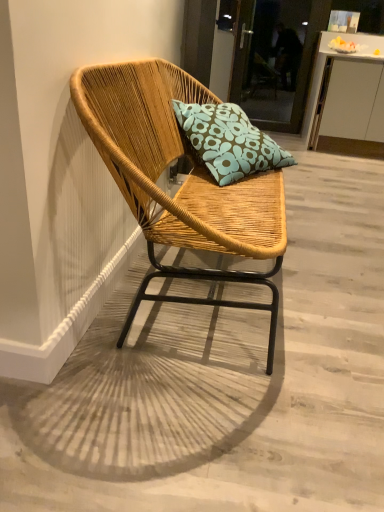
Describe the element at coordinates (225, 382) in the screenshot. I see `natural wood chair at center` at that location.

What is the approximate width of teal floral cushion at center?

20.39 inches.

Identify the location of natural wood chair at center. This screenshot has width=384, height=512. (225, 382).

This screenshot has height=512, width=384. I want to click on glass door behind the white glossy cabinet at upper right, so click(x=304, y=67).

Is transparent glass door at upper center turned away from white glossy cabinet at upper right?

That's not correct — transparent glass door at upper center is not looking away from white glossy cabinet at upper right.

Considering the relative sizes of transparent glass door at upper center and white glossy cabinet at upper right in the image provided, is transparent glass door at upper center shorter than white glossy cabinet at upper right?

Incorrect, the height of transparent glass door at upper center does not fall short of that of white glossy cabinet at upper right.

How different are the orientations of transparent glass door at upper center and white glossy cabinet at upper right in degrees?

The angular difference between transparent glass door at upper center and white glossy cabinet at upper right is 0.00107 degrees.

Is white glossy cabinet at upper right next to transparent glass door at upper center?

No, white glossy cabinet at upper right is not beside transparent glass door at upper center.

Can you confirm if white glossy cabinet at upper right is bigger than transparent glass door at upper center?

Yes, white glossy cabinet at upper right is bigger than transparent glass door at upper center.

Considering the relative sizes of white glossy cabinet at upper right and transparent glass door at upper center in the image provided, is white glossy cabinet at upper right shorter than transparent glass door at upper center?

A: Yes, white glossy cabinet at upper right is shorter than transparent glass door at upper center.

From the image's perspective, is white glossy cabinet at upper right located above transparent glass door at upper center?

Incorrect, from the image's perspective, white glossy cabinet at upper right is lower than transparent glass door at upper center.

Is transparent glass door at upper center spatially inside natural wood chair at center, or outside of it?

transparent glass door at upper center lies outside natural wood chair at center.

Which is behind, point (322, 18) or point (382, 388)?

The point (322, 18) is behind.

Is transparent glass door at upper center bigger or smaller than natural wood chair at center?

In the image, transparent glass door at upper center appears to be smaller than natural wood chair at center.

Who is shorter, transparent glass door at upper center or natural wood chair at center?

natural wood chair at center is shorter.

Looking at this image, how different are the orientations of natural wood chair at center and teal floral cushion at center in degrees?

50 degrees.

In order to click on pillow above the natural wood chair at center (from a real-world perspective) in this screenshot , I will do `click(228, 141)`.

Which is more to the left, natural wood chair at center or teal floral cushion at center?

teal floral cushion at center.

From the image's perspective, is natural wood chair at center above or below teal floral cushion at center?

From the image's perspective, natural wood chair at center appears below teal floral cushion at center.

Which object is closer to the camera taking this photo, natural wood chair at center or transparent glass door at upper center?

natural wood chair at center is more forward.

In terms of height, does natural wood chair at center look taller or shorter compared to transparent glass door at upper center?

natural wood chair at center is shorter than transparent glass door at upper center.

From the image's perspective, is natural wood chair at center located above or below transparent glass door at upper center?

Clearly, from the image's perspective, natural wood chair at center is below transparent glass door at upper center.

Considering the relative sizes of teal floral cushion at center and transparent glass door at upper center in the image provided, is teal floral cushion at center smaller than transparent glass door at upper center?

Correct, teal floral cushion at center occupies less space than transparent glass door at upper center.

This screenshot has height=512, width=384. What are the coordinates of `pillow that appears below the transparent glass door at upper center (from a real-world perspective)` in the screenshot? It's located at (228, 141).

From a real-world perspective, is teal floral cushion at center on top of transparent glass door at upper center?

Actually, teal floral cushion at center is physically below transparent glass door at upper center in the real world.

Is teal floral cushion at center oriented away from transparent glass door at upper center?

No, teal floral cushion at center is not facing away from transparent glass door at upper center.

In the scene shown: How different are the orientations of teal floral cushion at center and natural wood chair at center in degrees?

50 degrees.

I want to click on pillow above the natural wood chair at center (from a real-world perspective), so click(228, 141).

Is natural wood chair at center at the back of teal floral cushion at center?

No, teal floral cushion at center's orientation is not away from natural wood chair at center.

Where is `glass door behind the white glossy cabinet at upper right`? This screenshot has height=512, width=384. glass door behind the white glossy cabinet at upper right is located at coordinates (304, 67).

At what (x,y) coordinates should I click in order to perform the action: click on glass door above the white glossy cabinet at upper right (from a real-world perspective). Please return your answer as a coordinate pair (x, y). Looking at the image, I should click on (304, 67).

Based on their spatial positions, is natural wood chair at center or teal floral cushion at center further from white glossy cabinet at upper right?

The object further to white glossy cabinet at upper right is natural wood chair at center.

Estimate the real-world distances between objects in this image. Which object is further from teal floral cushion at center, transparent glass door at upper center or natural wood chair at center?

transparent glass door at upper center is positioned further to the anchor teal floral cushion at center.

Estimate the real-world distances between objects in this image. Which object is further from natural wood chair at center, white glossy cabinet at upper right or transparent glass door at upper center?

Based on the image, transparent glass door at upper center appears to be further to natural wood chair at center.

Considering their positions, is natural wood chair at center positioned further to teal floral cushion at center than transparent glass door at upper center?

transparent glass door at upper center is positioned further to the anchor teal floral cushion at center.

Considering their positions, is white glossy cabinet at upper right positioned further to transparent glass door at upper center than natural wood chair at center?

The object further to transparent glass door at upper center is natural wood chair at center.

Based on the photo, which object lies further to the anchor point natural wood chair at center, white glossy cabinet at upper right or teal floral cushion at center?

Among the two, white glossy cabinet at upper right is located further to natural wood chair at center.

Based on their spatial positions, is teal floral cushion at center or transparent glass door at upper center closer to white glossy cabinet at upper right?

transparent glass door at upper center lies closer to white glossy cabinet at upper right than the other object.

Based on the photo, which object lies nearer to the anchor point transparent glass door at upper center, teal floral cushion at center or natural wood chair at center?

teal floral cushion at center lies closer to transparent glass door at upper center than the other object.

You are a GUI agent. You are given a task and a screenshot of the screen. Output one action in this format:
    pyautogui.click(x=<x>, y=<y>)
    Task: Click on the table positioned between teal floral cushion at center and transparent glass door at upper center from near to far
    
    Given the screenshot: What is the action you would take?
    pyautogui.click(x=347, y=98)

I want to click on pillow between natural wood chair at center and transparent glass door at upper center along the z-axis, so click(x=228, y=141).

This screenshot has width=384, height=512. Identify the location of table between natural wood chair at center and transparent glass door at upper center from front to back. (347, 98).

At what (x,y) coordinates should I click in order to perform the action: click on pillow positioned between natural wood chair at center and white glossy cabinet at upper right from near to far. Please return your answer as a coordinate pair (x, y). The height and width of the screenshot is (512, 384). Looking at the image, I should click on (228, 141).